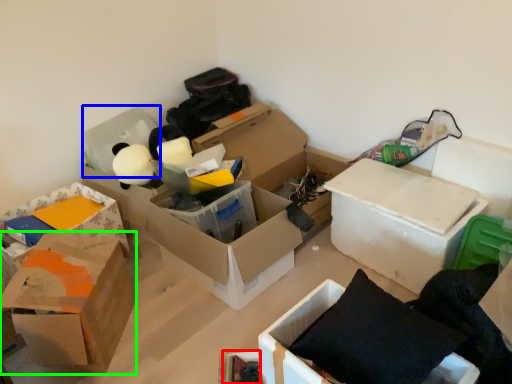
Question: Based on their relative distances, which object is nearer to storage box (highlighted by a red box)? Choose from storage box (highlighted by a blue box) and box (highlighted by a green box).

Choices:
 (A) storage box
 (B) box

Answer: (B)